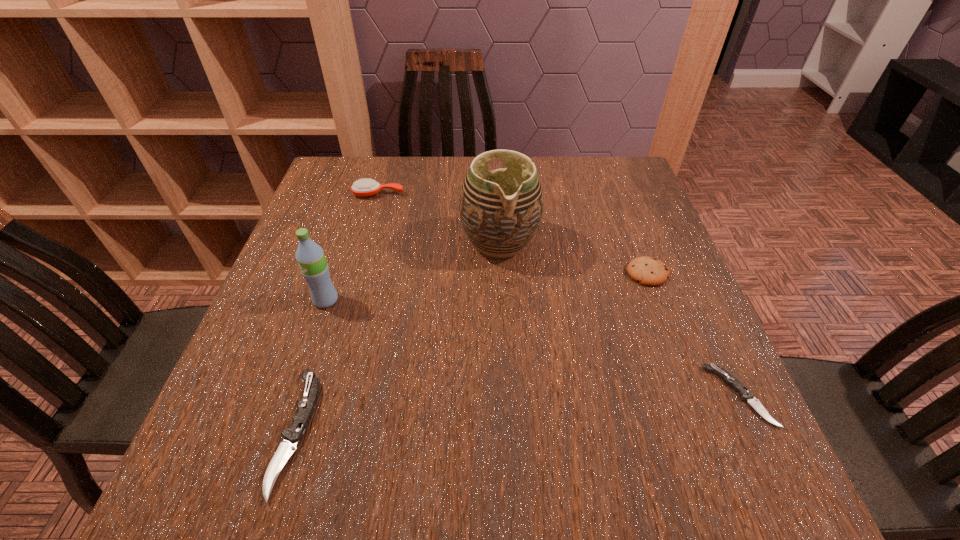
Where is `cookie that is at the right edge`? The height and width of the screenshot is (540, 960). cookie that is at the right edge is located at coordinates (648, 271).

Locate an element on the screen. The width and height of the screenshot is (960, 540). object that is at the far left corner is located at coordinates (364, 187).

Where is `object that is at the near left corner`? object that is at the near left corner is located at coordinates (293, 435).

This screenshot has width=960, height=540. Find the location of `object located in the near right corner section of the desktop`. object located in the near right corner section of the desktop is located at coordinates (746, 395).

Where is `vacant space at the far edge`? This screenshot has width=960, height=540. vacant space at the far edge is located at coordinates 578,182.

The width and height of the screenshot is (960, 540). What are the coordinates of `blank space at the left edge` in the screenshot? It's located at (346, 282).

The width and height of the screenshot is (960, 540). I want to click on free region at the right edge of the desktop, so click(x=655, y=290).

Image resolution: width=960 pixels, height=540 pixels. In order to click on vacant space at the far left corner in this screenshot , I will do `click(329, 165)`.

The width and height of the screenshot is (960, 540). I want to click on vacant area at the near left corner, so click(x=287, y=429).

In the image, there is a desktop. Where is `free region at the far right corner`? The height and width of the screenshot is (540, 960). free region at the far right corner is located at coordinates (628, 160).